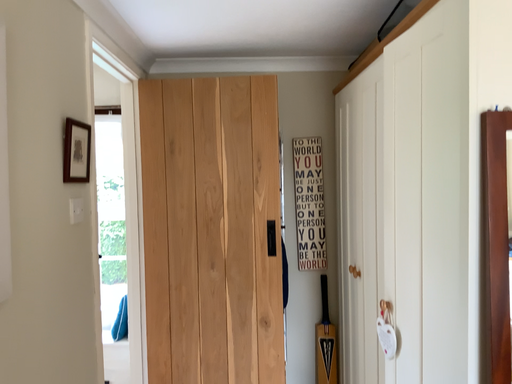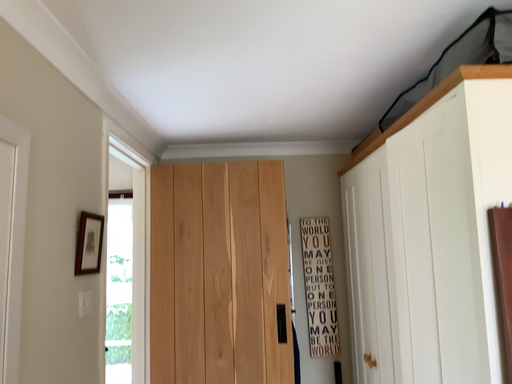
Question: How did the camera likely rotate when shooting the video?

Choices:
 (A) rotated upward
 (B) rotated downward

Answer: (A)